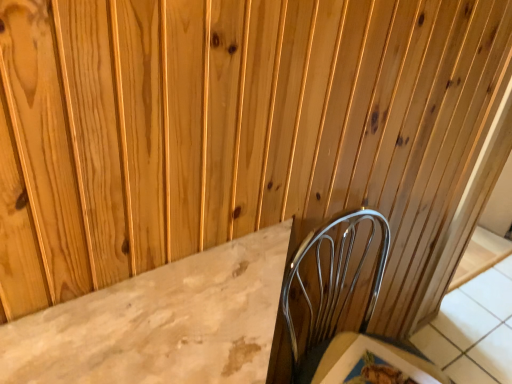
What do you see at coordinates (376, 356) in the screenshot? I see `marble textured table at lower right` at bounding box center [376, 356].

In order to click on marble textured table at lower right in this screenshot , I will do `click(376, 356)`.

Identify the location of marble textured table at lower right. This screenshot has height=384, width=512. (376, 356).